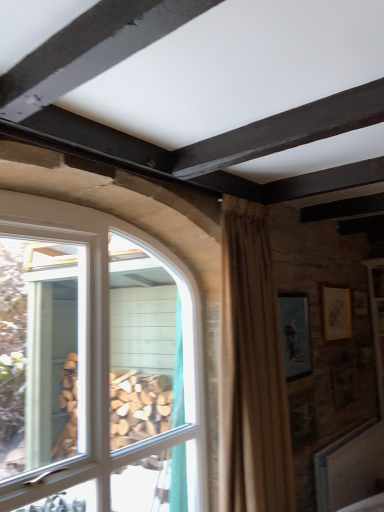
Question: Is beige textured curtain at center taller than white glass window at left?

Choices:
 (A) no
 (B) yes

Answer: (A)

Question: Is beige textured curtain at center far from white glass window at left?

Choices:
 (A) no
 (B) yes

Answer: (A)

Question: Can white glass window at left be found inside beige textured curtain at center?

Choices:
 (A) yes
 (B) no

Answer: (B)

Question: Is beige textured curtain at center to the right of white glass window at left from the viewer's perspective?

Choices:
 (A) no
 (B) yes

Answer: (B)

Question: Is white glass window at left at the back of beige textured curtain at center?

Choices:
 (A) yes
 (B) no

Answer: (A)

Question: From a real-world perspective, relative to matte blue picture frame at upper right, the first picture frame from the left, is white glass window at left vertically above or below?

Choices:
 (A) below
 (B) above

Answer: (A)

Question: Is point (198, 502) closer or farther from the camera than point (291, 330)?

Choices:
 (A) farther
 (B) closer

Answer: (B)

Question: Relative to matte blue picture frame at upper right, the first picture frame from the left, is white glass window at left in front or behind?

Choices:
 (A) front
 (B) behind

Answer: (A)

Question: Is white glass window at left inside the boundaries of matte blue picture frame at upper right, which appears as the 2th picture frame when viewed from the back, or outside?

Choices:
 (A) inside
 (B) outside

Answer: (B)

Question: Is beige textured curtain at center to the left or to the right of matte blue picture frame at upper right, the first picture frame from the left, in the image?

Choices:
 (A) right
 (B) left

Answer: (B)

Question: Is point (256, 238) positioned closer to the camera than point (299, 302)?

Choices:
 (A) closer
 (B) farther

Answer: (A)

Question: Considering the positions of beige textured curtain at center and matte blue picture frame at upper right, arranged as the second picture frame when viewed from the right, in the image, is beige textured curtain at center bigger or smaller than matte blue picture frame at upper right, arranged as the second picture frame when viewed from the right,?

Choices:
 (A) small
 (B) big

Answer: (B)

Question: From a real-world perspective, is beige textured curtain at center positioned above or below matte blue picture frame at upper right, which ranks as the first picture frame in front-to-back order?

Choices:
 (A) above
 (B) below

Answer: (B)

Question: Based on their sizes in the image, would you say matte gold picture frame at upper right, arranged as the 2th picture frame when viewed from the front, is bigger or smaller than white glass window at left?

Choices:
 (A) small
 (B) big

Answer: (A)

Question: From the image's perspective, is matte gold picture frame at upper right, which ranks as the second picture frame in left-to-right order, above or below white glass window at left?

Choices:
 (A) below
 (B) above

Answer: (B)